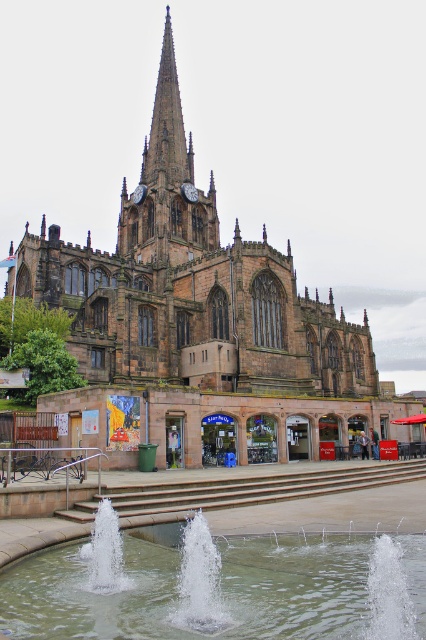
Question: Is brown stone church at center below brown stone spire at upper center?

Choices:
 (A) no
 (B) yes

Answer: (B)

Question: Is brown stone church at center further to camera compared to clear water fountain at lower center?

Choices:
 (A) no
 (B) yes

Answer: (B)

Question: Which of the following is the farthest from the observer?

Choices:
 (A) brown stone spire at upper center
 (B) brown stone church at center

Answer: (A)

Question: Does brown stone church at center have a greater width compared to brown stone spire at upper center?

Choices:
 (A) no
 (B) yes

Answer: (B)

Question: Which object is closer to the camera taking this photo?

Choices:
 (A) brown stone church at center
 (B) clear water fountain at lower center
 (C) brown stone spire at upper center

Answer: (B)

Question: Based on their relative distances, which object is farther from the clear water fountain at lower center?

Choices:
 (A) brown stone church at center
 (B) brown stone spire at upper center

Answer: (B)